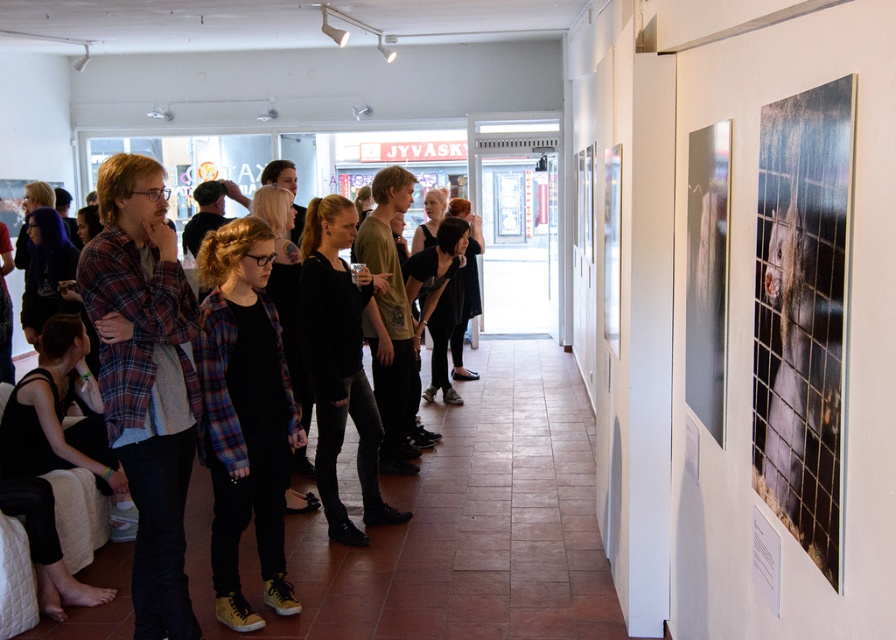
You are a GUI agent. You are given a task and a screenshot of the screen. Output one action in this format:
    pyautogui.click(x=<x>, y=<y>)
    Task: Click on the matte plaid shirt at left
    The image size is (896, 640).
    Given the screenshot: What is the action you would take?
    point(151,384)

Image resolution: width=896 pixels, height=640 pixels. What do you see at coordinates (244, 413) in the screenshot?
I see `plaid flannel shirt at center` at bounding box center [244, 413].

Can you confirm if plaid flannel shirt at center is thinner than black fabric at lower left?

Indeed, plaid flannel shirt at center has a lesser width compared to black fabric at lower left.

The height and width of the screenshot is (640, 896). I want to click on plaid flannel shirt at center, so click(x=244, y=413).

In the scene shown: Who is positioned more to the right, matte plaid shirt at left or plaid flannel shirt at center?

From the viewer's perspective, plaid flannel shirt at center appears more on the right side.

Is point (141, 634) positioned behind point (220, 250)?

No.

The height and width of the screenshot is (640, 896). What are the coordinates of `matte plaid shirt at left` in the screenshot? It's located at (151, 384).